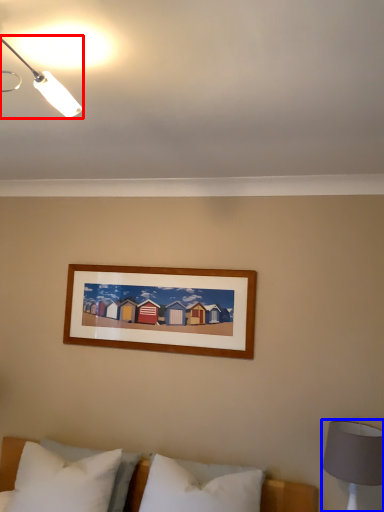
Question: Which object is closer to the camera taking this photo, lamp (highlighted by a red box) or bedside lamp (highlighted by a blue box)?

Choices:
 (A) lamp
 (B) bedside lamp

Answer: (A)